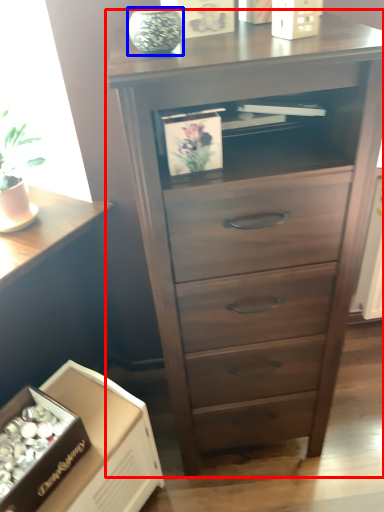
Question: Which object is closer to the camera taking this photo, chest of drawers (highlighted by a red box) or glass vase (highlighted by a blue box)?

Choices:
 (A) chest of drawers
 (B) glass vase

Answer: (A)